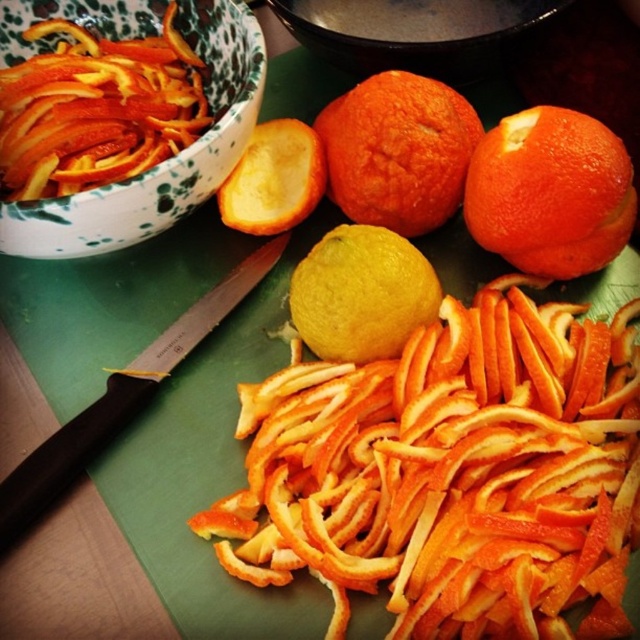
Does orangesmoothorange at right appear over yellow matte lemon at center?

Indeed, orangesmoothorange at right is positioned over yellow matte lemon at center.

Can you confirm if orangesmoothorange at right is bigger than yellow matte lemon at center?

Yes.

You are a GUI agent. You are given a task and a screenshot of the screen. Output one action in this format:
    pyautogui.click(x=<x>, y=<y>)
    Task: Click on the orangesmoothorange at right
    Image resolution: width=640 pixels, height=640 pixels.
    Given the screenshot: What is the action you would take?
    [x=550, y=193]

Does matte ceramic bowl at upper center appear on the right side of black plastic knife at upper left?

Indeed, matte ceramic bowl at upper center is positioned on the right side of black plastic knife at upper left.

Between matte ceramic bowl at upper center and black plastic knife at upper left, which one is positioned lower?

Positioned lower is black plastic knife at upper left.

Find the location of `matte ceramic bowl at upper center`. matte ceramic bowl at upper center is located at coordinates (413, 33).

Where is `matte ceramic bowl at upper center`? The height and width of the screenshot is (640, 640). matte ceramic bowl at upper center is located at coordinates (413, 33).

Can you confirm if orangesmoothorange at right is positioned below black plastic knife at upper left?

Actually, orangesmoothorange at right is above black plastic knife at upper left.

Does orangesmoothorange at right have a greater height compared to black plastic knife at upper left?

In fact, orangesmoothorange at right may be shorter than black plastic knife at upper left.

Is point (586, 154) more distant than point (12, 477)?

That is True.

The height and width of the screenshot is (640, 640). What are the coordinates of `orangesmoothorange at right` in the screenshot? It's located at (550, 193).